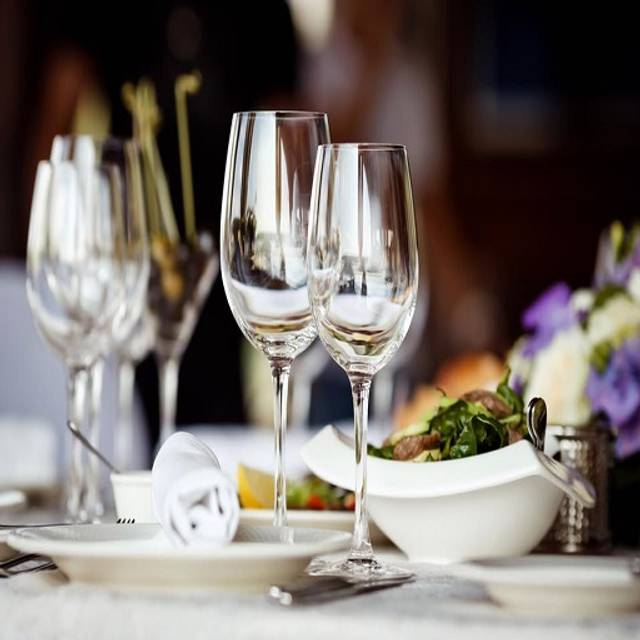
Find the location of a particular element. plate is located at coordinates (148, 573).